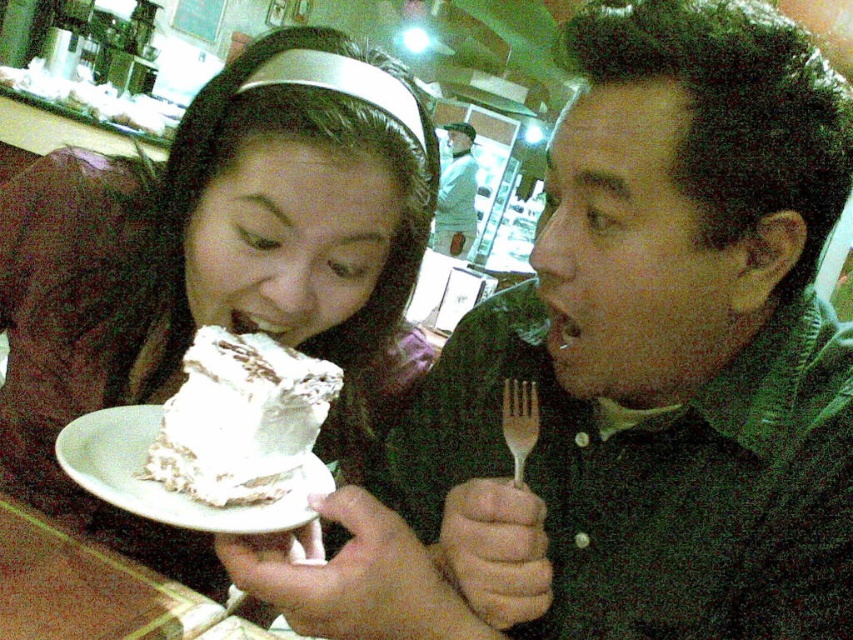
Question: Which of the following is the closest to the observer?

Choices:
 (A) wooden fork at center
 (B) matte white cake at left
 (C) white matte plate at lower left

Answer: (A)

Question: Which of these objects is positioned farthest from the light blue fabric shirt at center?

Choices:
 (A) wooden fork at center
 (B) matte white cake at left

Answer: (A)

Question: Is matte white cake at left further to the viewer compared to wooden fork at center?

Choices:
 (A) no
 (B) yes

Answer: (B)

Question: Does white matte plate at lower left come in front of light blue fabric shirt at center?

Choices:
 (A) yes
 (B) no

Answer: (A)

Question: Can you confirm if matte black fork at upper right is positioned below white matte plate at lower left?

Choices:
 (A) no
 (B) yes

Answer: (A)

Question: Which object is farther from the camera taking this photo?

Choices:
 (A) white matte plate at lower left
 (B) matte black fork at upper right

Answer: (A)